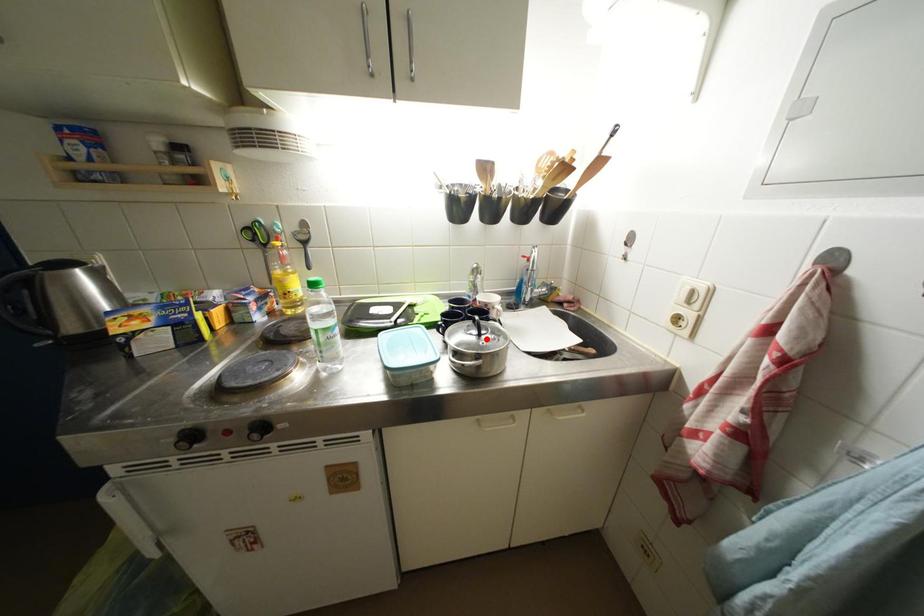
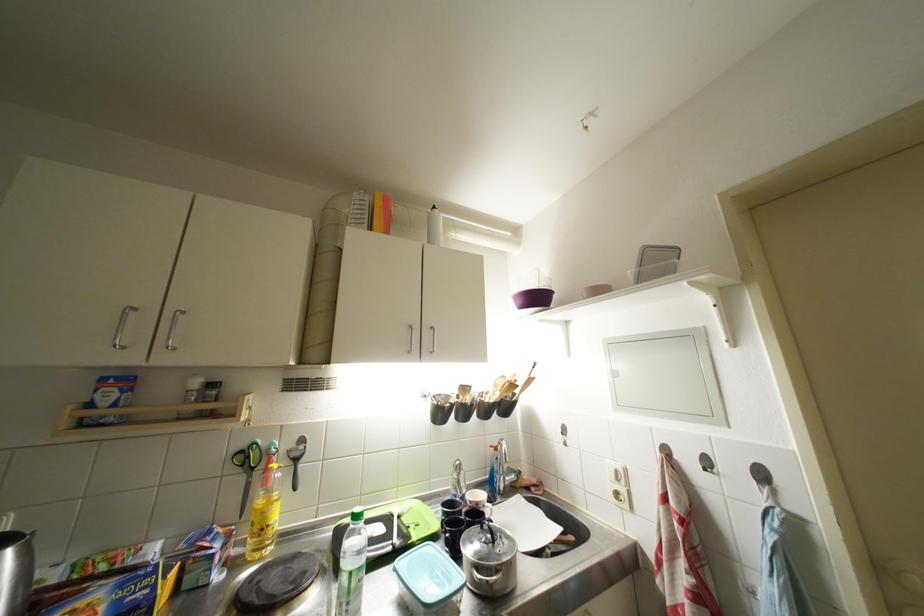
Find the pixel in the second image that matches the highlighted location in the first image.

(500, 546)